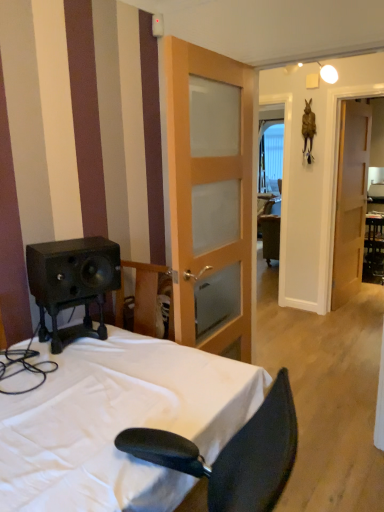
Question: From their relative heights in the image, would you say wooden door at right, the 1th door in the right-to-left sequence, is taller or shorter than clear glass window at center?

Choices:
 (A) short
 (B) tall

Answer: (B)

Question: Would you say wooden door at right, placed as the 2th door when sorted from left to right, is to the left or to the right of clear glass window at center in the picture?

Choices:
 (A) right
 (B) left

Answer: (B)

Question: Which object is positioned farthest from the clear glass window at center?

Choices:
 (A) light brown wooden door at center, which is the first door from front to back
 (B) black glossy table at right
 (C) wooden door at right, the second door in the front-to-back sequence
 (D) white fabric bed at lower left

Answer: (D)

Question: Which of these objects is positioned farthest from the clear glass window at center?

Choices:
 (A) wooden door at right, the 1th door in the right-to-left sequence
 (B) black glossy table at right
 (C) light brown wooden door at center, which is the second door from back to front
 (D) white fabric bed at lower left

Answer: (D)